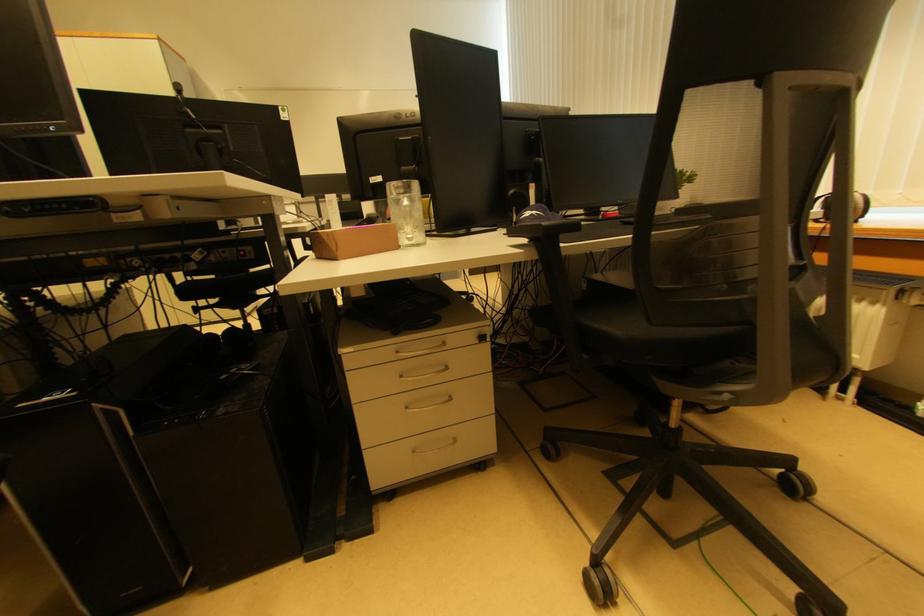
Identify the location of glass mug handle. (406, 228).